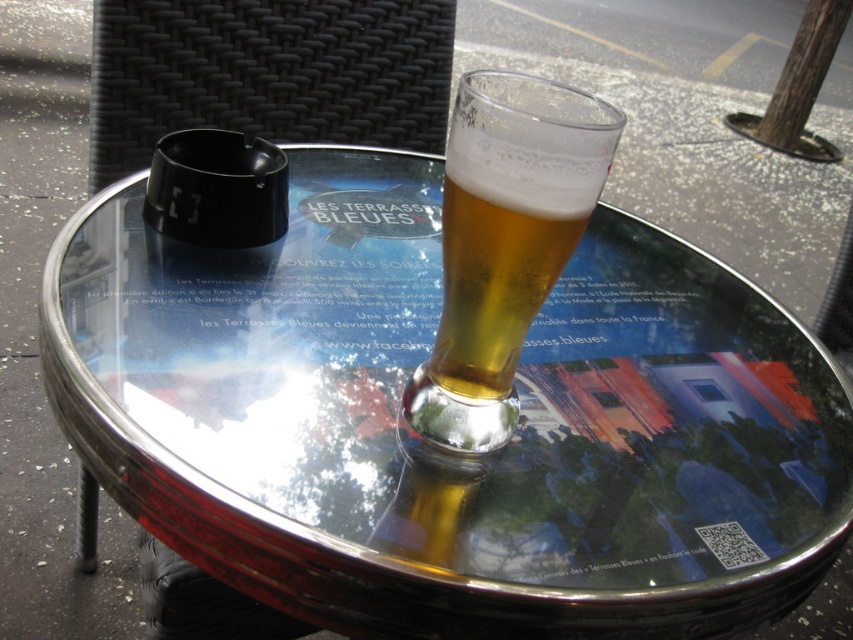
You are standing at the edge of the table and want to place a napkin between the two points marked as point (602, 394) and point (436, 384). Which point is closer to you so you can reach it first?

Point (436, 384) is closer to you than point (602, 394), so you can reach it first.

You are a server at the outdoor cafe and need to place a new menu on the table without covering any existing items. Where should you place the menu so it doesn t cover the transparent glass table at center or the translucent glass beer at center?

The transparent glass table at center is bigger than the translucent glass beer at center, so you can place the menu on the transparent glass table at center near its edges where it doesn t overlap the beer.

You are standing at the edge of the table and want to place a small napkin at point (445, 458). Is this point on the table?

The point (445, 458) is on the transparent glass table at center, so yes, placing the napkin there would be on the table.